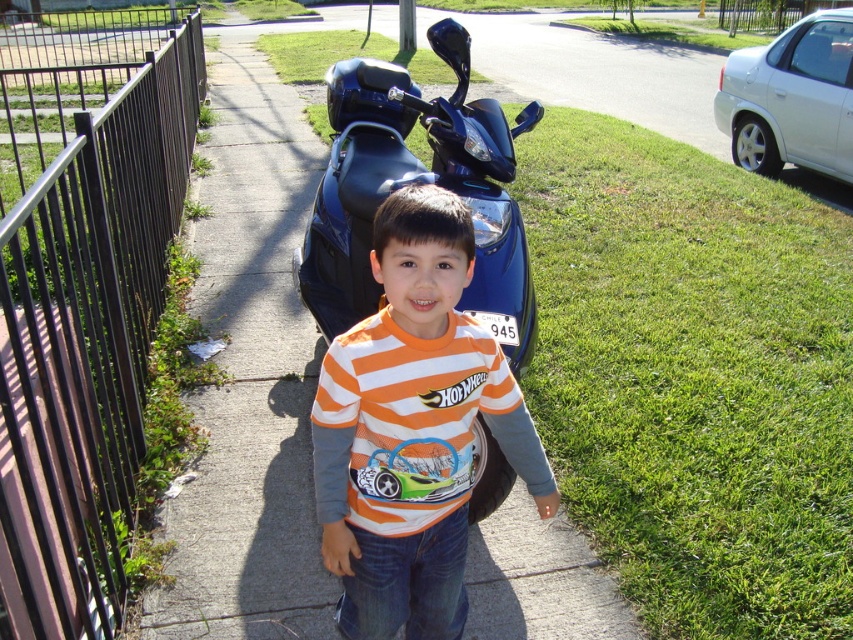
What do you see at coordinates (250, 376) in the screenshot?
I see `smooth concrete pavement at center` at bounding box center [250, 376].

Is smooth concrete pavement at center smaller than orange striped shirt at center?

No, smooth concrete pavement at center is not smaller than orange striped shirt at center.

Find the location of a particular element. smooth concrete pavement at center is located at coordinates (250, 376).

Measure the distance from black metal fence at left to orange striped shirt at center.

The distance of black metal fence at left from orange striped shirt at center is 84.79 centimeters.

Can you confirm if black metal fence at left is taller than orange striped shirt at center?

Indeed, black metal fence at left has a greater height compared to orange striped shirt at center.

Who is more forward, (123, 461) or (402, 609)?

Point (402, 609) is in front.

Identify the location of black metal fence at left. (86, 342).

Is smooth concrete pavement at center further to camera compared to black metal fence at left?

That is True.

Measure the distance from smooth concrete pavement at center to black metal fence at left.

A distance of 2.61 meters exists between smooth concrete pavement at center and black metal fence at left.

The image size is (853, 640). What are the coordinates of `smooth concrete pavement at center` in the screenshot? It's located at (250, 376).